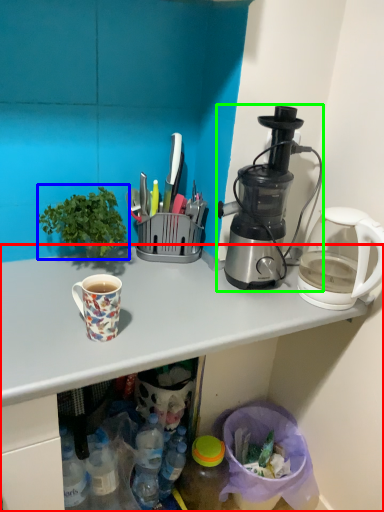
Question: Which is farther away from desk (highlighted by a red box)? houseplant (highlighted by a blue box) or blender (highlighted by a green box)?

Choices:
 (A) houseplant
 (B) blender

Answer: (A)